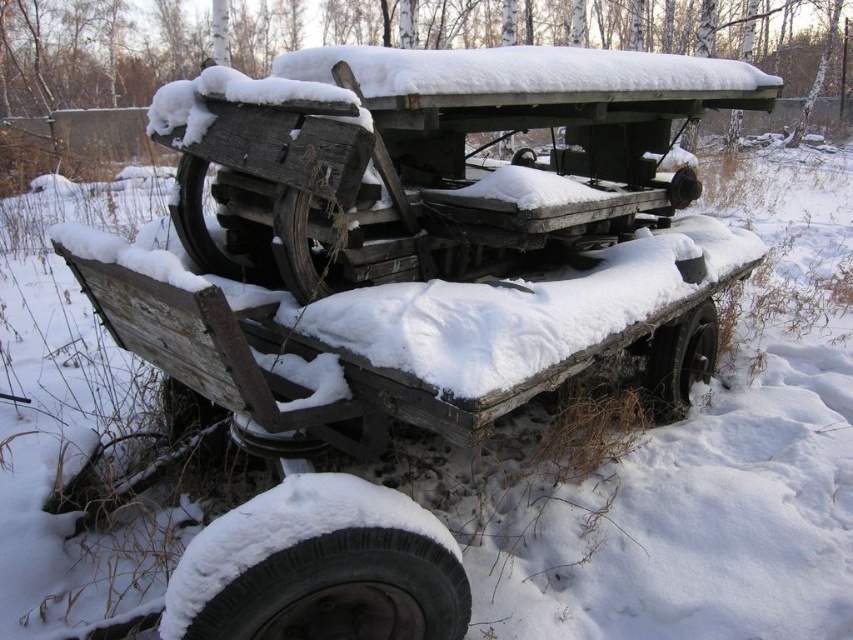
Question: Considering the relative positions of snow-covered rubber tire at lower left and black rubber tire at lower right in the image provided, where is snow-covered rubber tire at lower left located with respect to black rubber tire at lower right?

Choices:
 (A) below
 (B) above

Answer: (A)

Question: Can you confirm if wooden wagon at center is positioned above black rubber tire at lower right?

Choices:
 (A) no
 (B) yes

Answer: (B)

Question: Which is nearer to the snow-covered rubber tire at lower left?

Choices:
 (A) dark gray rubber tire at center
 (B) wooden wagon at center

Answer: (B)

Question: Which point is farther from the camera taking this photo?

Choices:
 (A) (343, 561)
 (B) (477, 184)

Answer: (B)

Question: Which object is farther from the camera taking this photo?

Choices:
 (A) dark gray rubber tire at center
 (B) wooden wagon at center

Answer: (A)

Question: Considering the relative positions of snow-covered rubber tire at lower left and black rubber tire at lower right in the image provided, where is snow-covered rubber tire at lower left located with respect to black rubber tire at lower right?

Choices:
 (A) above
 (B) below

Answer: (B)